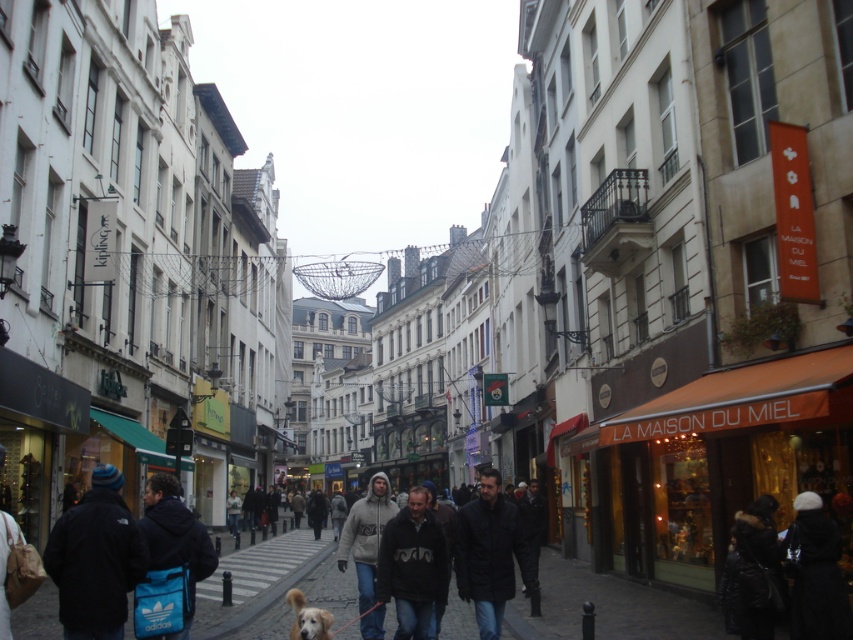
You are a delivery person trying to navigate through the busy street in the image. You need to deliver a package to a location marked by point (80, 561) and then to another location marked by point (294, 602). Since the street is crowded, you want to take the shortest path possible. Which point should you visit first to minimize your walking distance?

You should visit point (80, 561) first because it is in front of point (294, 602), so going to the first point first will allow you to reach both points with less backtracking.

You are a photographer standing on the street and want to take a photo of the historic buildings while avoiding people in the frame. The dark blue fleece jacket at lower left and the black leather jacket at center are blocking your view. Which person should you move first to clear the path?

The dark blue fleece jacket at lower left is in front of the black leather jacket at center, so you should move the dark blue fleece jacket at lower left first to clear the path.